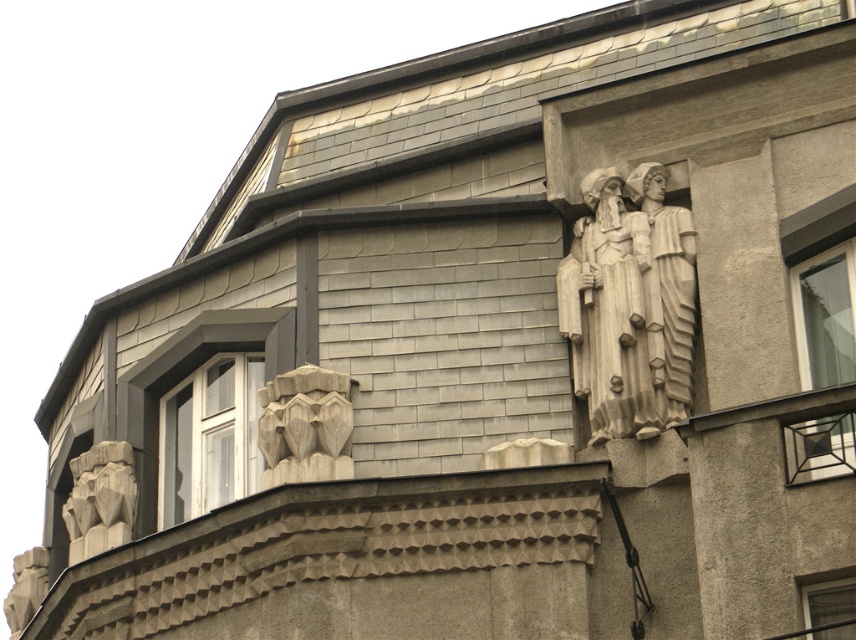
From the picture: Can you confirm if white stone sculpture at upper right is positioned to the right of transparent glass window at upper right?

Incorrect, white stone sculpture at upper right is not on the right side of transparent glass window at upper right.

Does point (623, 292) come farther from viewer compared to point (825, 596)?

Yes, it is behind point (825, 596).

This screenshot has height=640, width=856. Identify the location of white stone sculpture at upper right. (629, 304).

Which is above, white stone sculpture at upper right or white glass window at lower left?

Positioned higher is white stone sculpture at upper right.

Does white stone sculpture at upper right come behind white glass window at lower left?

That is False.

Who is more distant from viewer, [669,269] or [189,449]?

Positioned behind is point [189,449].

Where is `white stone sculpture at upper right`? Image resolution: width=856 pixels, height=640 pixels. white stone sculpture at upper right is located at coordinates (629, 304).

This screenshot has height=640, width=856. Describe the element at coordinates (210, 436) in the screenshot. I see `white glass window at lower left` at that location.

Which is behind, point (254, 435) or point (79, 512)?

Point (79, 512)

Locate an element on the screen. This screenshot has width=856, height=640. white glass window at lower left is located at coordinates (210, 436).